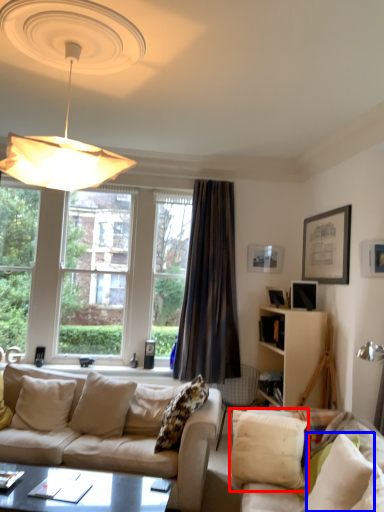
Question: Among these objects, which one is nearest to the camera, pillow (highlighted by a red box) or pillow (highlighted by a blue box)?

Choices:
 (A) pillow
 (B) pillow

Answer: (B)